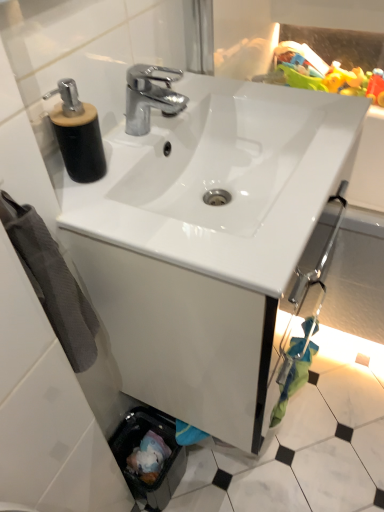
Question: From a real-world perspective, is white glossy sink at center beneath black matte soap dispenser at upper left?

Choices:
 (A) no
 (B) yes

Answer: (B)

Question: From a real-world perspective, is white glossy sink at center physically above black matte soap dispenser at upper left?

Choices:
 (A) no
 (B) yes

Answer: (A)

Question: Is white glossy sink at center behind black matte soap dispenser at upper left?

Choices:
 (A) no
 (B) yes

Answer: (A)

Question: Is white glossy sink at center turned away from black matte soap dispenser at upper left?

Choices:
 (A) yes
 (B) no

Answer: (B)

Question: Is black matte soap dispenser at upper left completely or partially inside white glossy sink at center?

Choices:
 (A) yes
 (B) no

Answer: (B)

Question: In terms of size, does plastic green toy at upper right appear bigger or smaller than gray cotton towel at left?

Choices:
 (A) big
 (B) small

Answer: (A)

Question: Does point (316, 67) appear closer or farther from the camera than point (74, 371)?

Choices:
 (A) farther
 (B) closer

Answer: (A)

Question: Is plastic green toy at upper right wider or thinner than gray cotton towel at left?

Choices:
 (A) thin
 (B) wide

Answer: (B)

Question: Considering the relative positions of plastic green toy at upper right and gray cotton towel at left in the image provided, is plastic green toy at upper right to the left or to the right of gray cotton towel at left?

Choices:
 (A) left
 (B) right

Answer: (B)

Question: From a real-world perspective, is gray cotton towel at left positioned above or below black matte soap dispenser at upper left?

Choices:
 (A) below
 (B) above

Answer: (A)

Question: Considering the positions of gray cotton towel at left and black matte soap dispenser at upper left in the image, is gray cotton towel at left taller or shorter than black matte soap dispenser at upper left?

Choices:
 (A) short
 (B) tall

Answer: (B)

Question: From the image's perspective, is gray cotton towel at left positioned above or below black matte soap dispenser at upper left?

Choices:
 (A) above
 (B) below

Answer: (B)

Question: Considering their positions, is gray cotton towel at left located in front of or behind black matte soap dispenser at upper left?

Choices:
 (A) front
 (B) behind

Answer: (A)

Question: In terms of size, does white glossy sink at center appear bigger or smaller than black matte soap dispenser at upper left?

Choices:
 (A) small
 (B) big

Answer: (B)

Question: Is white glossy sink at center in front of or behind black matte soap dispenser at upper left in the image?

Choices:
 (A) behind
 (B) front

Answer: (B)